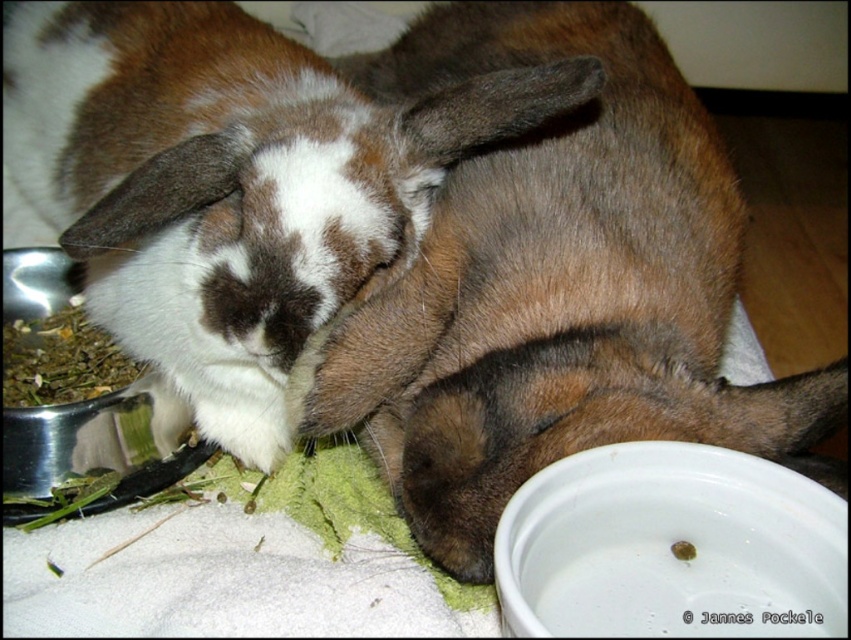
Question: Which point is closer to the camera?

Choices:
 (A) (52, 353)
 (B) (663, 451)
 (C) (677, 276)

Answer: (B)

Question: Among these points, which one is farthest from the camera?

Choices:
 (A) (729, 612)
 (B) (201, 444)
 (C) (209, 120)
 (D) (73, 308)

Answer: (D)

Question: Can you confirm if white glossy bowl at lower right is bigger than metallic silver bowl at lower left?

Choices:
 (A) yes
 (B) no

Answer: (A)

Question: Can you confirm if brown fur rabbit at center is positioned to the left of white glossy bowl at lower right?

Choices:
 (A) yes
 (B) no

Answer: (A)

Question: Can you confirm if brown fur rabbit at center is positioned above green leafy material at left?

Choices:
 (A) yes
 (B) no

Answer: (A)

Question: Considering the real-world distances, which object is closest to the brown fur rabbit at center?

Choices:
 (A) green leafy material at left
 (B) white glossy bowl at lower right

Answer: (B)